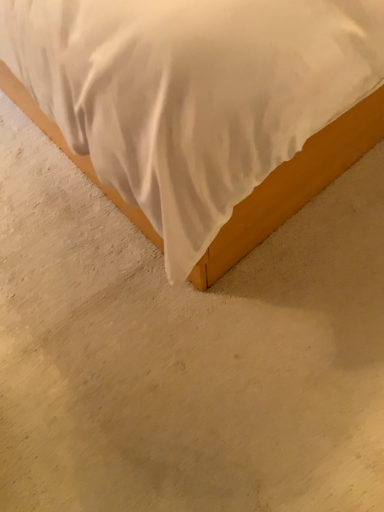
What do you see at coordinates (206, 105) in the screenshot? This screenshot has width=384, height=512. I see `satin white bed at center` at bounding box center [206, 105].

The image size is (384, 512). In order to click on satin white bed at center in this screenshot , I will do `click(206, 105)`.

Locate an element on the screen. This screenshot has width=384, height=512. satin white bed at center is located at coordinates (206, 105).